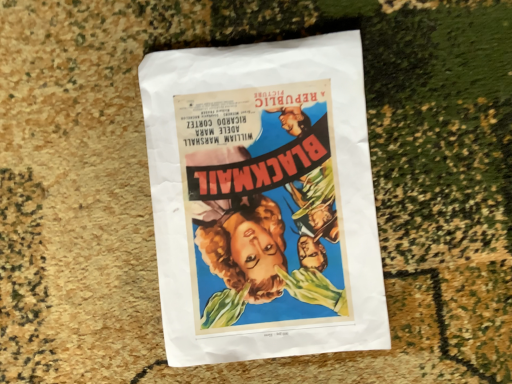
Measure the distance between point (224, 212) and camera.

They are 15.75 inches apart.

Describe the element at coordinates (263, 200) in the screenshot. I see `matte paper poster at center` at that location.

Find the location of `matte paper poster at center`. matte paper poster at center is located at coordinates (263, 200).

Where is `matte paper poster at center`? This screenshot has width=512, height=384. matte paper poster at center is located at coordinates (263, 200).